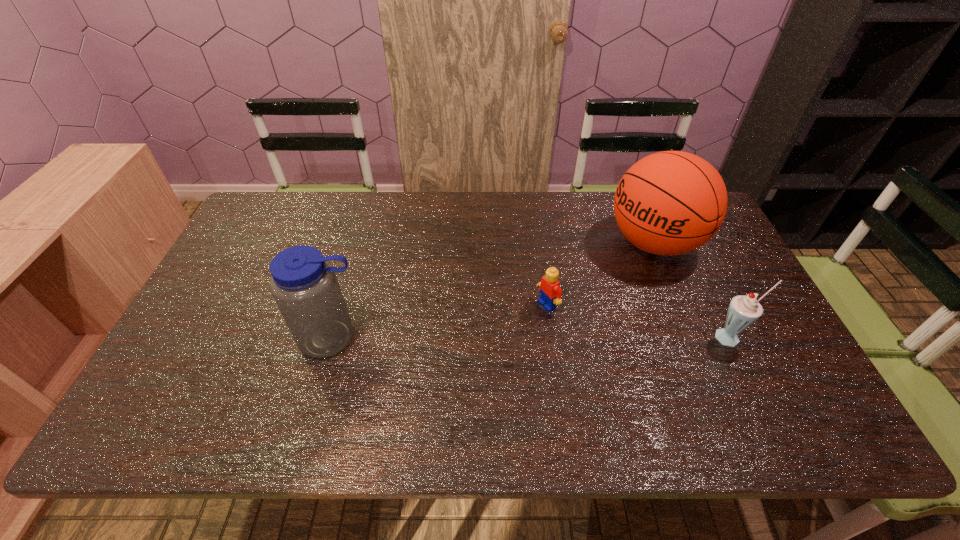
Find the location of a particular element. vacant space located on the face of the second object from left to right is located at coordinates (512, 326).

At what (x,y) coordinates should I click in order to perform the action: click on free space located 0.210m on the face of the second object from left to right. Please return your answer as a coordinate pair (x, y). Looking at the image, I should click on (473, 347).

Identify the location of free region located on the face of the second object from left to right. Image resolution: width=960 pixels, height=540 pixels. (524, 319).

Image resolution: width=960 pixels, height=540 pixels. Identify the location of object that is at the far edge. (668, 203).

The width and height of the screenshot is (960, 540). In order to click on milkshake that is at the right edge in this screenshot , I will do `click(744, 310)`.

Locate an element on the screen. basketball positioned at the right edge is located at coordinates (668, 203).

Locate an element on the screen. The image size is (960, 540). object at the far right corner is located at coordinates (668, 203).

In the image, there is a desktop. Identify the location of vacant space at the far edge. (385, 200).

Identify the location of blank space at the near edge of the desktop. This screenshot has width=960, height=540. (299, 374).

Where is `vacant region at the left edge`? The height and width of the screenshot is (540, 960). vacant region at the left edge is located at coordinates (266, 279).